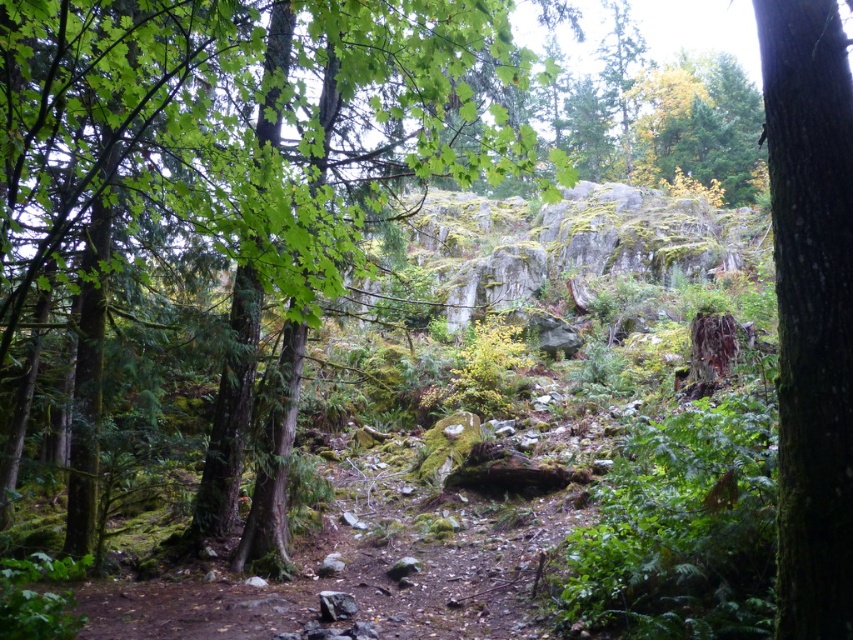
Who is positioned more to the left, green mossy tree at center or green mossy bark tree at right?

Positioned to the left is green mossy tree at center.

This screenshot has width=853, height=640. Describe the element at coordinates (239, 154) in the screenshot. I see `green mossy tree at center` at that location.

This screenshot has height=640, width=853. I want to click on green mossy tree at center, so click(x=239, y=154).